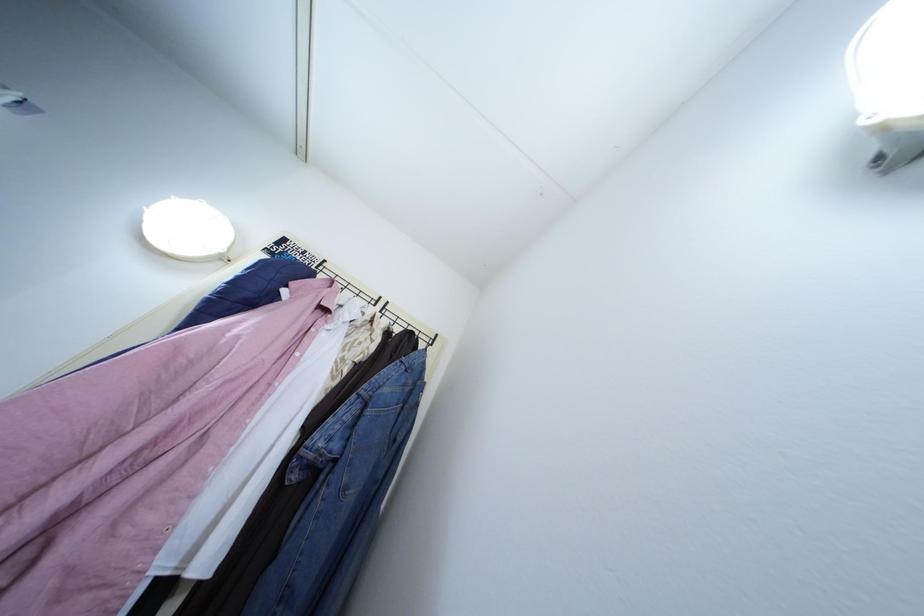
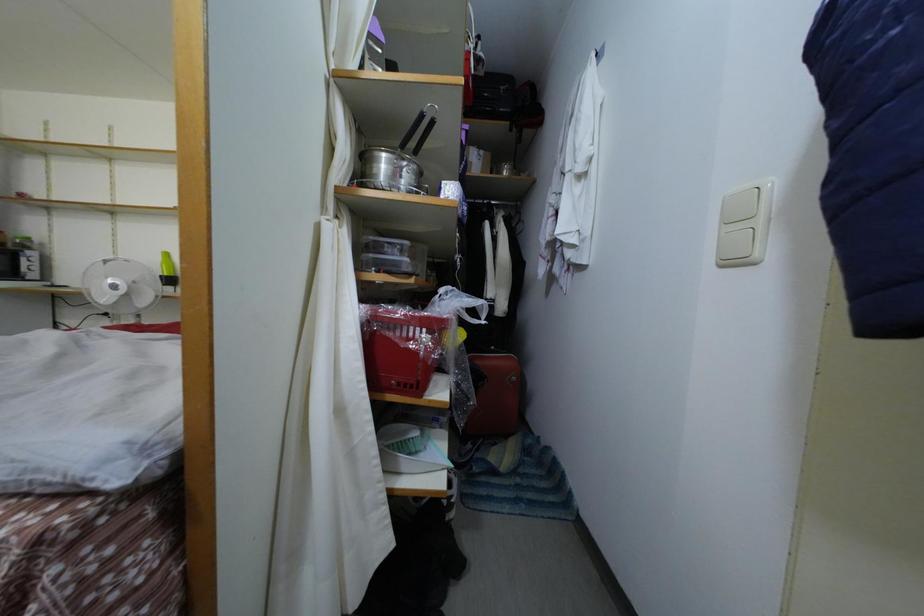
The first image is from the beginning of the video and the second image is from the end. How did the camera likely rotate when shooting the video?

The camera's rotation is toward left-up.